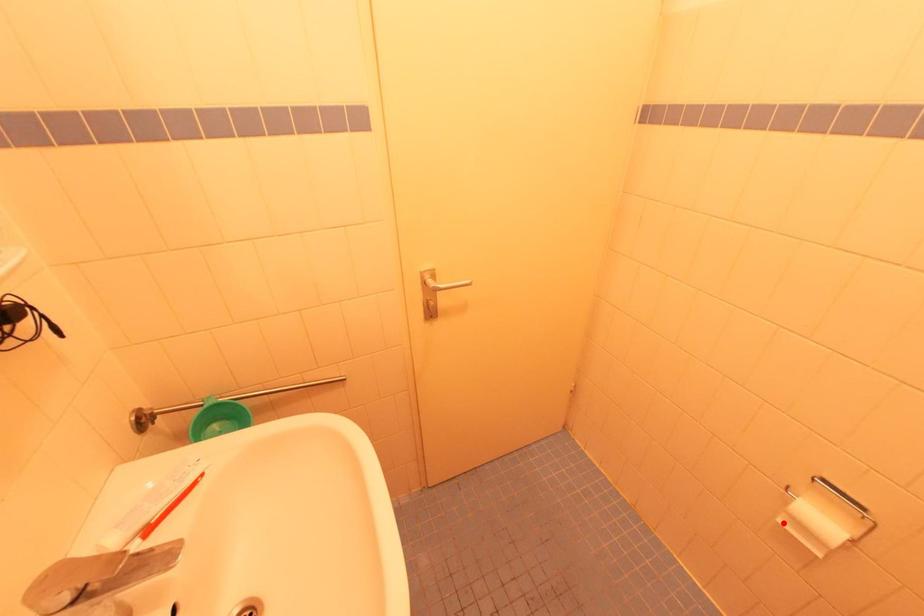
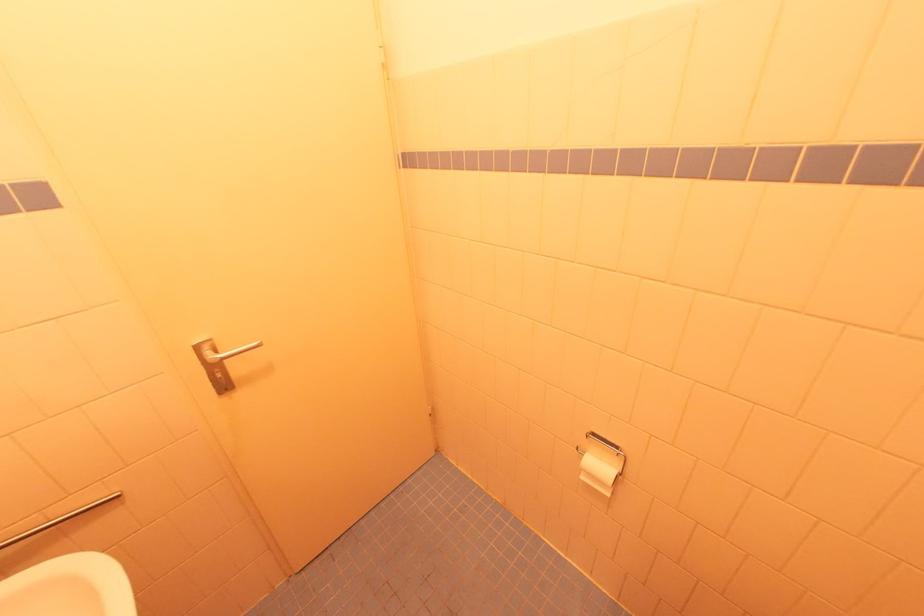
Where in the second image is the point corresponding to the highlighted location from the first image?

(585, 479)